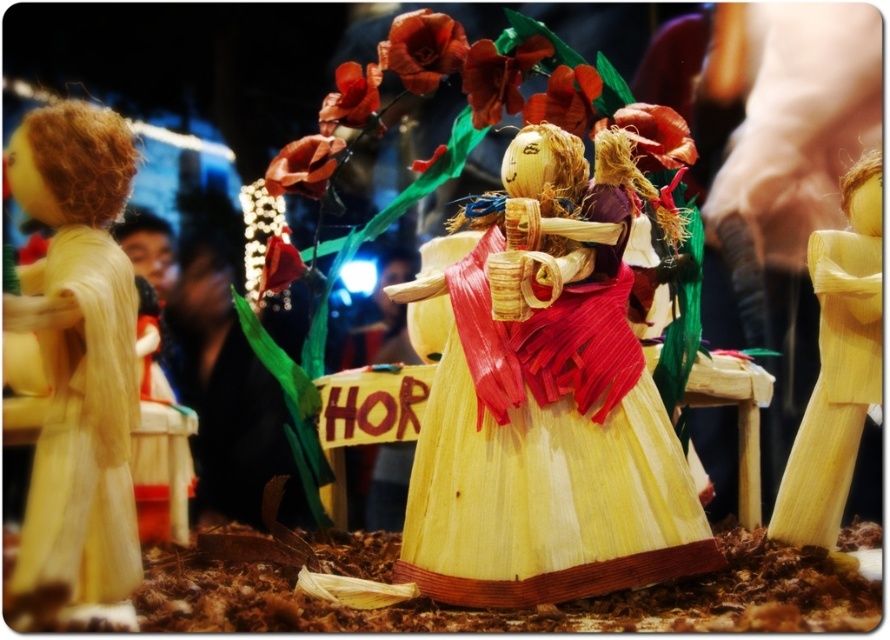
Question: Which point is farther to the camera?

Choices:
 (A) natural straw doll at right
 (B) natural straw dress at center
 (C) matte yellow corn husk doll at left

Answer: (A)

Question: Can you confirm if natural straw dress at center is wider than natural straw doll at right?

Choices:
 (A) no
 (B) yes

Answer: (B)

Question: Is the position of natural straw dress at center less distant than that of matte yellow corn husk doll at left?

Choices:
 (A) no
 (B) yes

Answer: (A)

Question: Estimate the real-world distances between objects in this image. Which object is farther from the natural straw doll at right?

Choices:
 (A) natural straw dress at center
 (B) matte yellow corn husk doll at left

Answer: (B)

Question: Can you confirm if matte yellow corn husk doll at left is positioned to the right of natural straw doll at right?

Choices:
 (A) yes
 (B) no

Answer: (B)

Question: Which object is positioned farthest from the natural straw dress at center?

Choices:
 (A) matte yellow corn husk doll at left
 (B) natural straw doll at right

Answer: (A)